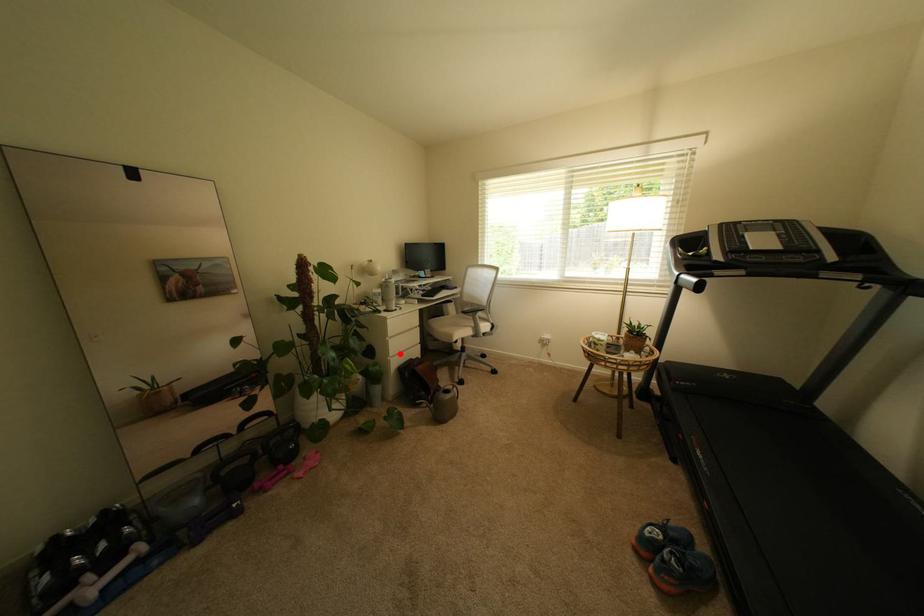
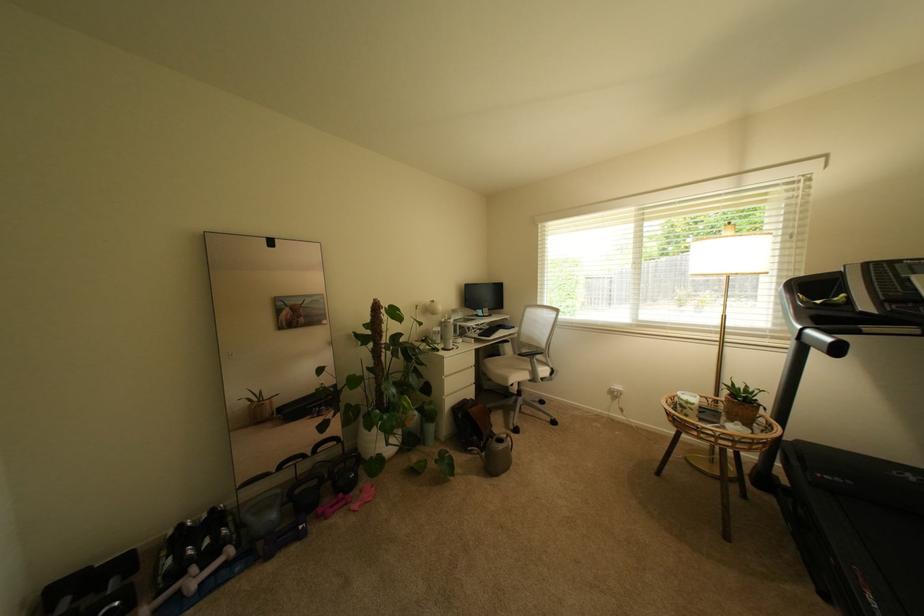
Question: I am providing you with two images of the same scene from different viewpoints. Given a red point in image1, look at the same physical point in image2. Is it:

Choices:
 (A) Closer to the viewpoint
 (B) Farther from the viewpoint

Answer: (B)